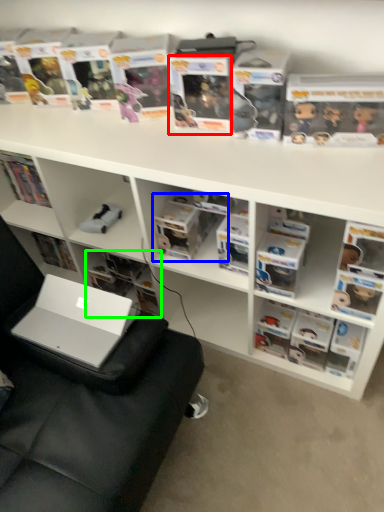
Question: Which object is the farthest from paperback book (highlighted by a red box)? Choose among these: book (highlighted by a blue box) or book (highlighted by a green box).

Choices:
 (A) book
 (B) book

Answer: (B)